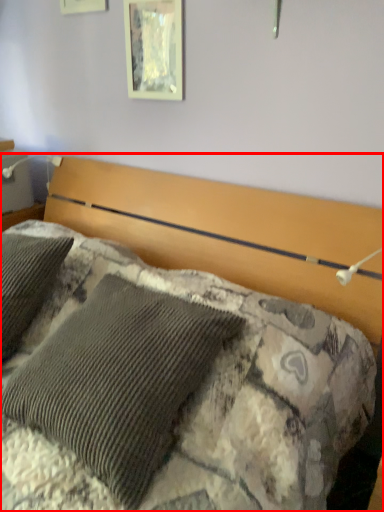
Question: Where is bed (annotated by the red box) located in relation to picture frame in the image?

Choices:
 (A) right
 (B) left

Answer: (B)